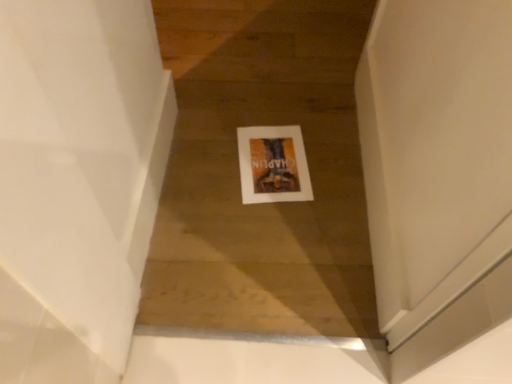
What do you see at coordinates (77, 183) in the screenshot? The height and width of the screenshot is (384, 512). I see `white glossy wall at upper left` at bounding box center [77, 183].

You are a GUI agent. You are given a task and a screenshot of the screen. Output one action in this format:
    pyautogui.click(x=<x>, y=<y>)
    Task: Click on the white glossy wall at upper left
    This screenshot has height=384, width=512.
    Given the screenshot: What is the action you would take?
    pyautogui.click(x=77, y=183)

What is the approximate height of white matte picture frame at center?

It is 0.45 inches.

Identify the location of white matte picture frame at center. The image size is (512, 384). (273, 165).

What do you see at coordinates (273, 165) in the screenshot? I see `white matte picture frame at center` at bounding box center [273, 165].

Identify the location of white glossy wall at upper left. This screenshot has height=384, width=512. (77, 183).

Based on their positions, is white matte picture frame at center located to the left or right of white glossy wall at upper left?

Clearly, white matte picture frame at center is on the right of white glossy wall at upper left in the image.

Consider the image. Is white matte picture frame at center closer to the viewer compared to white glossy wall at upper left?

No.

Looking at this image, which point is more forward, (x=298, y=150) or (x=41, y=115)?

The point (x=41, y=115) is in front.

From the image's perspective, which is above, white matte picture frame at center or white glossy wall at upper left?

white matte picture frame at center is shown above in the image.

From a real-world perspective, is white matte picture frame at center physically located above or below white glossy wall at upper left?

Clearly, from a real-world perspective, white matte picture frame at center is below white glossy wall at upper left.

Considering the relative sizes of white matte picture frame at center and white glossy wall at upper left in the image provided, is white matte picture frame at center thinner than white glossy wall at upper left?

In fact, white matte picture frame at center might be wider than white glossy wall at upper left.

Can you confirm if white matte picture frame at center is taller than white glossy wall at upper left?

No.

Is white matte picture frame at center bigger than white glossy wall at upper left?

Incorrect, white matte picture frame at center is not larger than white glossy wall at upper left.

Is white matte picture frame at center completely or partially outside of white glossy wall at upper left?

Yes, white matte picture frame at center is located beyond the bounds of white glossy wall at upper left.

Is white matte picture frame at center placed right next to white glossy wall at upper left?

No, white matte picture frame at center is not touching white glossy wall at upper left.

Is white matte picture frame at center facing away from white glossy wall at upper left?

white matte picture frame at center is not turned away from white glossy wall at upper left.

Where is `picture frame behind the white glossy wall at upper left`? The height and width of the screenshot is (384, 512). picture frame behind the white glossy wall at upper left is located at coordinates (273, 165).

Considering the relative positions of white glossy wall at upper left and white matte picture frame at center in the image provided, is white glossy wall at upper left to the left of white matte picture frame at center from the viewer's perspective?

Yes, white glossy wall at upper left is to the left of white matte picture frame at center.

Does white glossy wall at upper left lie in front of white matte picture frame at center?

Yes.

Which point is more distant from viewer, (31, 178) or (242, 180)?

Positioned behind is point (242, 180).

From the image's perspective, is white glossy wall at upper left located above or below white matte picture frame at center?

white glossy wall at upper left is below white matte picture frame at center.

From a real-world perspective, which object stands above the other?

white glossy wall at upper left, from a real-world perspective.

Considering the sizes of white glossy wall at upper left and white matte picture frame at center in the image, is white glossy wall at upper left wider or thinner than white matte picture frame at center?

Clearly, white glossy wall at upper left has less width compared to white matte picture frame at center.

Between white glossy wall at upper left and white matte picture frame at center, which one has more height?

white glossy wall at upper left.

Between white glossy wall at upper left and white matte picture frame at center, which one has larger size?

With larger size is white glossy wall at upper left.

Is white glossy wall at upper left inside or outside of white matte picture frame at center?

white glossy wall at upper left exists outside the volume of white matte picture frame at center.

Is white glossy wall at upper left not close to white matte picture frame at center?

No.

Is white glossy wall at upper left turned away from white matte picture frame at center?

That's not correct — white glossy wall at upper left is not looking away from white matte picture frame at center.

The image size is (512, 384). What are the coordinates of `picture frame below the white glossy wall at upper left (from a real-world perspective)` in the screenshot? It's located at (273, 165).

Locate an element on the screen. This screenshot has height=384, width=512. picture frame lying on the right of white glossy wall at upper left is located at coordinates (273, 165).

The width and height of the screenshot is (512, 384). Find the location of `picture frame that appears above the white glossy wall at upper left (from the image's perspective)`. picture frame that appears above the white glossy wall at upper left (from the image's perspective) is located at coordinates (273, 165).